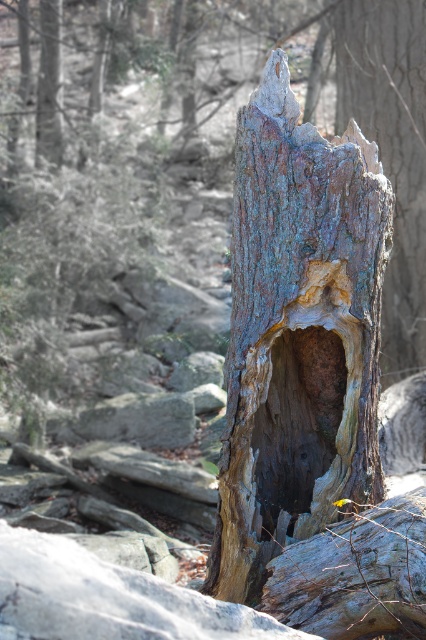
You are a hiker who wants to place a small backpack on the rusty wood tree trunk at center. However, you notice the dark wood hole at center nearby. Which object is taller so that you can safely place your backpack there?

The rusty wood tree trunk at center is taller than the dark wood hole at center, so you can safely place your backpack on the rusty wood tree trunk at center.

You are a hiker who has stumbled upon this tree stump. You want to place a small compass on the rusty wood tree trunk at center so that it stays visible. However, you also want to avoid placing it in the dark wood hole at center. Where should you place the compass?

The rusty wood tree trunk at center is closer to the viewer than the dark wood hole at center, so placing the compass on the rusty wood tree trunk at center will keep it visible and away from the dark wood hole at center.

You are a hiker who wants to place a small backpack between the rusty wood tree trunk at center and the dark wood hole at center. Based on their positions, which object should you place the backpack closer to if you want it to be on the left side of the path?

The dark wood hole at center is to the left of the rusty wood tree trunk at center. To place the backpack on the left side of the path, position it closer to the dark wood hole at center.